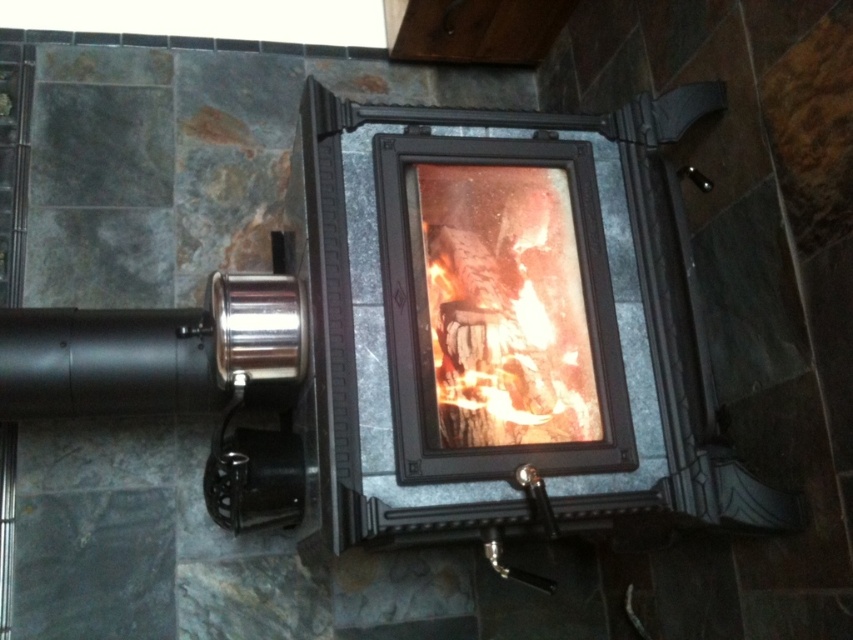
Question: Which object is closer to the camera taking this photo?

Choices:
 (A) orange glowing wood at center
 (B) matte black fireplace at center

Answer: (B)

Question: Does matte black fireplace at center appear under orange glowing wood at center?

Choices:
 (A) yes
 (B) no

Answer: (B)

Question: Observing the image, what is the correct spatial positioning of matte black fireplace at center in reference to orange glowing wood at center?

Choices:
 (A) above
 (B) below

Answer: (A)

Question: From the image, what is the correct spatial relationship of matte black fireplace at center in relation to orange glowing wood at center?

Choices:
 (A) below
 (B) above

Answer: (B)

Question: Which object is closer to the camera taking this photo?

Choices:
 (A) orange glowing wood at center
 (B) matte black fireplace at center

Answer: (B)